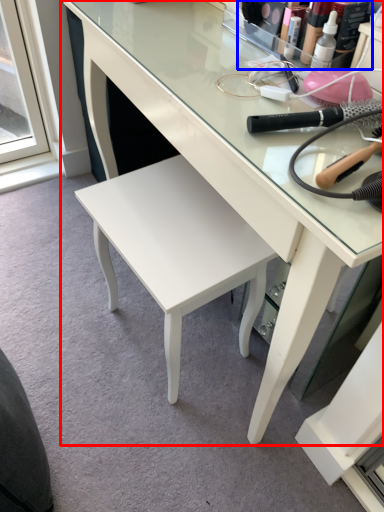
Question: Which of the following is the closest to the observer, desk (highlighted by a red box) or toiletry (highlighted by a blue box)?

Choices:
 (A) desk
 (B) toiletry

Answer: (A)